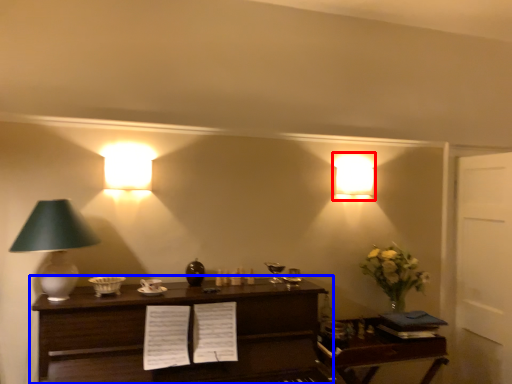
Question: Which object is further to the camera taking this photo, lamp (highlighted by a red box) or table (highlighted by a blue box)?

Choices:
 (A) lamp
 (B) table

Answer: (A)